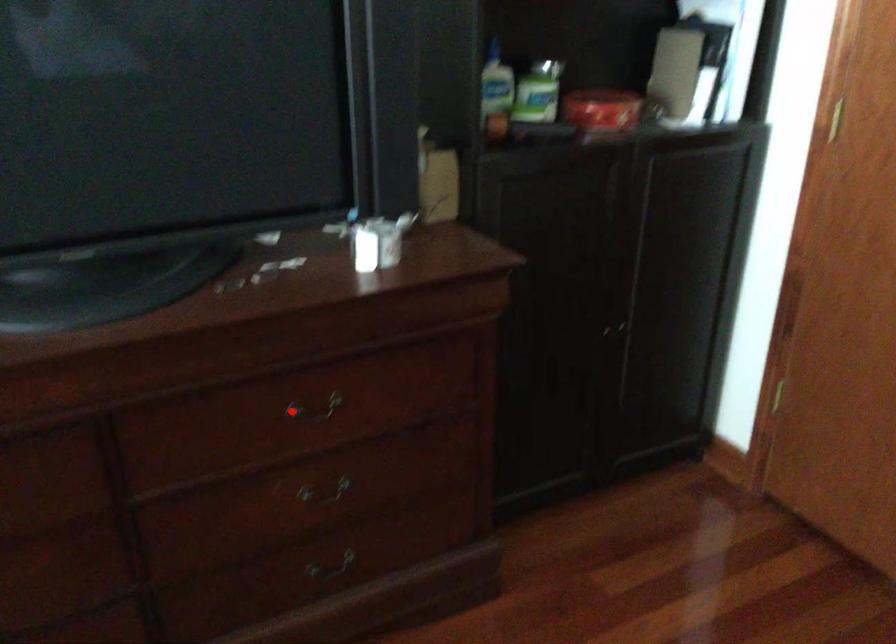
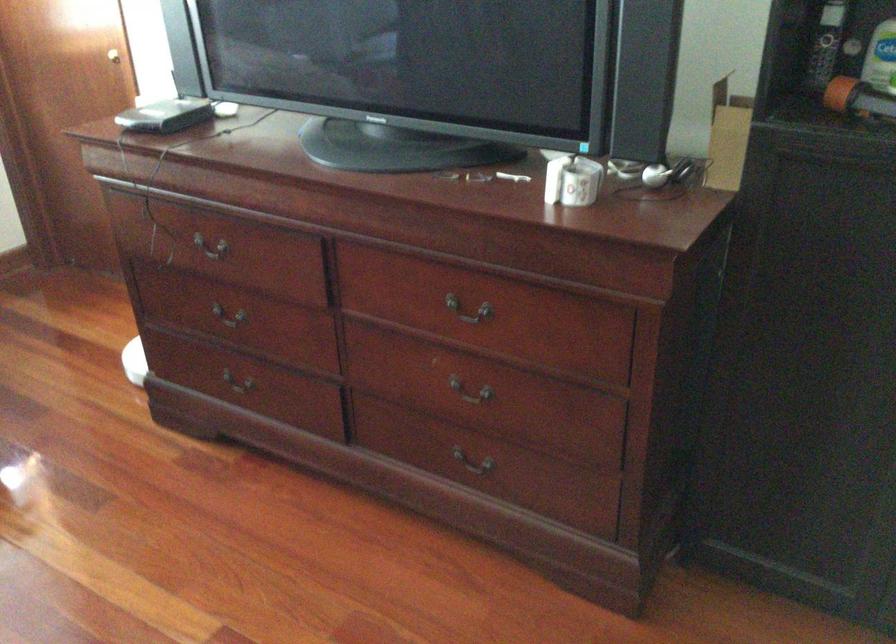
Question: A red point is marked in image1. In image2, is the corresponding 3D point closer to the camera or farther? Reply with the corresponding letter.

Choices:
 (A) The corresponding 3D point is closer.
 (B) The corresponding 3D point is farther.

Answer: (B)